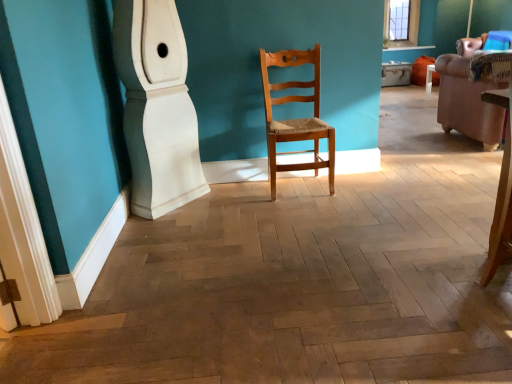
At what (x,y) coordinates should I click in order to perform the action: click on white glossy baseboard at lower left. Please return your answer as a coordinate pair (x, y). Image resolution: width=512 pixels, height=384 pixels. Looking at the image, I should click on (157, 107).

The width and height of the screenshot is (512, 384). Describe the element at coordinates (295, 119) in the screenshot. I see `natural wood chair at center` at that location.

At what (x,y) coordinates should I click in order to perform the action: click on white glossy baseboard at lower left. Please return your answer as a coordinate pair (x, y). The height and width of the screenshot is (384, 512). Looking at the image, I should click on (157, 107).

Which object is further away from the camera taking this photo, brown leather armchair at right or natural wood chair at center?

brown leather armchair at right.

Between brown leather armchair at right and natural wood chair at center, which one has larger width?

brown leather armchair at right.

Does point (501, 109) lie in front of point (274, 161)?

No, (501, 109) is further to viewer.

Looking at this image, is natural wood chair at center a part of brown leather armchair at right?

No, natural wood chair at center is located outside of brown leather armchair at right.

Is white glossy baseboard at lower left thinner than brown leather armchair at right?

Indeed, white glossy baseboard at lower left has a lesser width compared to brown leather armchair at right.

Is brown leather armchair at right surrounded by white glossy baseboard at lower left?

No, brown leather armchair at right is not inside white glossy baseboard at lower left.

Based on the photo, which is more to the right, white glossy baseboard at lower left or brown leather armchair at right?

brown leather armchair at right.

From the image's perspective, who appears lower, white glossy baseboard at lower left or brown leather armchair at right?

white glossy baseboard at lower left appears lower in the image.

Considering the sizes of objects natural wood chair at center and white glossy baseboard at lower left in the image provided, who is thinner, natural wood chair at center or white glossy baseboard at lower left?

natural wood chair at center.

The width and height of the screenshot is (512, 384). I want to click on chair on the right of the white glossy baseboard at lower left, so click(x=295, y=119).

From a real-world perspective, between natural wood chair at center and white glossy baseboard at lower left, who is vertically lower?

In real-world perspective, natural wood chair at center is lower.

Consider the image. What's the angular difference between natural wood chair at center and white glossy baseboard at lower left's facing directions?

The angle between the facing direction of natural wood chair at center and the facing direction of white glossy baseboard at lower left is 90 degrees.

Would you say white glossy baseboard at lower left is to the left or to the right of natural wood chair at center in the picture?

Clearly, white glossy baseboard at lower left is on the left of natural wood chair at center in the image.

Considering the positions of objects white glossy baseboard at lower left and natural wood chair at center in the image provided, who is in front, white glossy baseboard at lower left or natural wood chair at center?

white glossy baseboard at lower left is in front.

This screenshot has width=512, height=384. What are the coordinates of `chair beneath the white glossy baseboard at lower left (from a real-world perspective)` in the screenshot? It's located at (295, 119).

From a real-world perspective, is white glossy baseboard at lower left above or below natural wood chair at center?

From a real-world perspective, white glossy baseboard at lower left is physically above natural wood chair at center.

Considering the relative positions of natural wood chair at center and brown leather armchair at right in the image provided, is natural wood chair at center to the left of brown leather armchair at right from the viewer's perspective?

Indeed, natural wood chair at center is positioned on the left side of brown leather armchair at right.

Is the surface of natural wood chair at center in direct contact with brown leather armchair at right?

No, natural wood chair at center is not with brown leather armchair at right.

From the image's perspective, is natural wood chair at center over brown leather armchair at right?

No, from the image's perspective, natural wood chair at center is not over brown leather armchair at right.

Considering the sizes of objects natural wood chair at center and brown leather armchair at right in the image provided, who is shorter, natural wood chair at center or brown leather armchair at right?

brown leather armchair at right is shorter.

Where is `armchair located underneath the white glossy baseboard at lower left (from a real-world perspective)`? This screenshot has width=512, height=384. armchair located underneath the white glossy baseboard at lower left (from a real-world perspective) is located at coordinates (467, 97).

Which object is thinner, brown leather armchair at right or white glossy baseboard at lower left?

With smaller width is white glossy baseboard at lower left.

Is white glossy baseboard at lower left surrounded by brown leather armchair at right?

No, white glossy baseboard at lower left is located outside of brown leather armchair at right.

At what (x,y) coordinates should I click in order to perform the action: click on armchair that appears behind the natural wood chair at center. Please return your answer as a coordinate pair (x, y). Looking at the image, I should click on (467, 97).

Where is `armchair that appears below the white glossy baseboard at lower left (from a real-world perspective)`? armchair that appears below the white glossy baseboard at lower left (from a real-world perspective) is located at coordinates (467, 97).

Looking at this image, looking at the image, which one is located further to brown leather armchair at right, natural wood chair at center or white glossy baseboard at lower left?

white glossy baseboard at lower left is further to brown leather armchair at right.

Which object lies further to the anchor point natural wood chair at center, white glossy baseboard at lower left or brown leather armchair at right?

brown leather armchair at right.

Which object lies further to the anchor point white glossy baseboard at lower left, natural wood chair at center or brown leather armchair at right?

The object further to white glossy baseboard at lower left is brown leather armchair at right.

Consider the image. Based on their spatial positions, is brown leather armchair at right or white glossy baseboard at lower left closer to natural wood chair at center?

The object closer to natural wood chair at center is white glossy baseboard at lower left.

When comparing their distances from brown leather armchair at right, does white glossy baseboard at lower left or natural wood chair at center seem further?

white glossy baseboard at lower left.

Looking at the image, which one is located further to white glossy baseboard at lower left, brown leather armchair at right or natural wood chair at center?

The object further to white glossy baseboard at lower left is brown leather armchair at right.

You are a GUI agent. You are given a task and a screenshot of the screen. Output one action in this format:
    pyautogui.click(x=<x>, y=<y>)
    Task: Click on the chair between white glossy baseboard at lower left and brown leather armchair at right
    
    Given the screenshot: What is the action you would take?
    pyautogui.click(x=295, y=119)